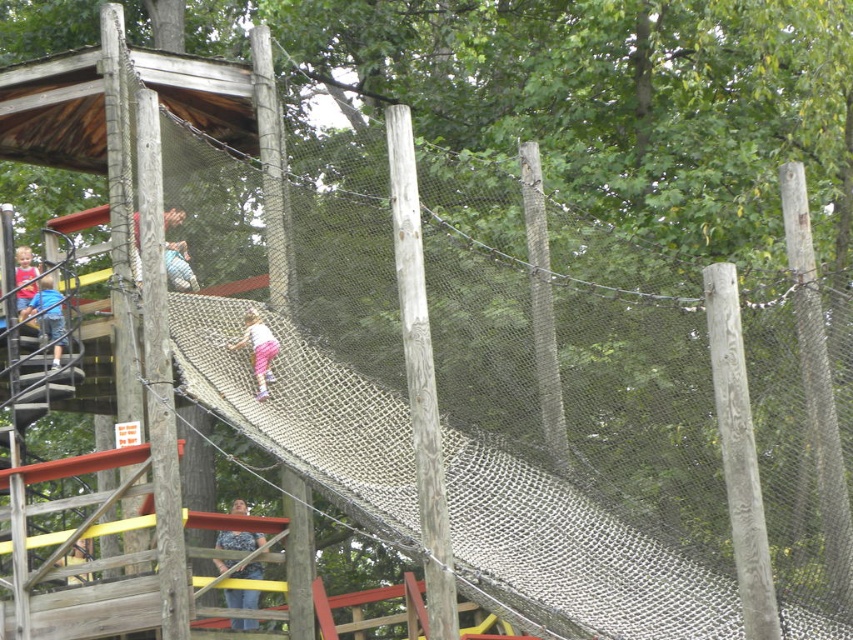
Which of these two, blue fabric at left or matte pink pants at left, stands taller?

With more height is matte pink pants at left.

Measure the distance between point [51,314] and camera.

The distance of point [51,314] from camera is 74.12 meters.

Who is more forward, (39,291) or (28,304)?

Positioned in front is point (39,291).

Locate an element on the screen. This screenshot has width=853, height=640. blue fabric at left is located at coordinates (48, 316).

Which is behind, point (56, 307) or point (252, 340)?

The point (56, 307) is more distant.

From the picture: Is blue fabric at left closer to the viewer compared to pink fabric pants at center?

No, it is behind pink fabric pants at center.

Is point (57, 346) positioned before point (244, 342)?

That is False.

Find the location of a particular element. This screenshot has height=640, width=853. blue fabric at left is located at coordinates (48, 316).

Can you confirm if blue denim jeans at upper center is smaller than matte pink pants at left?

Indeed, blue denim jeans at upper center has a smaller size compared to matte pink pants at left.

Is point (171, 262) closer to viewer compared to point (22, 301)?

Yes, it is in front of point (22, 301).

Where is `blue denim jeans at upper center`? blue denim jeans at upper center is located at coordinates (178, 266).